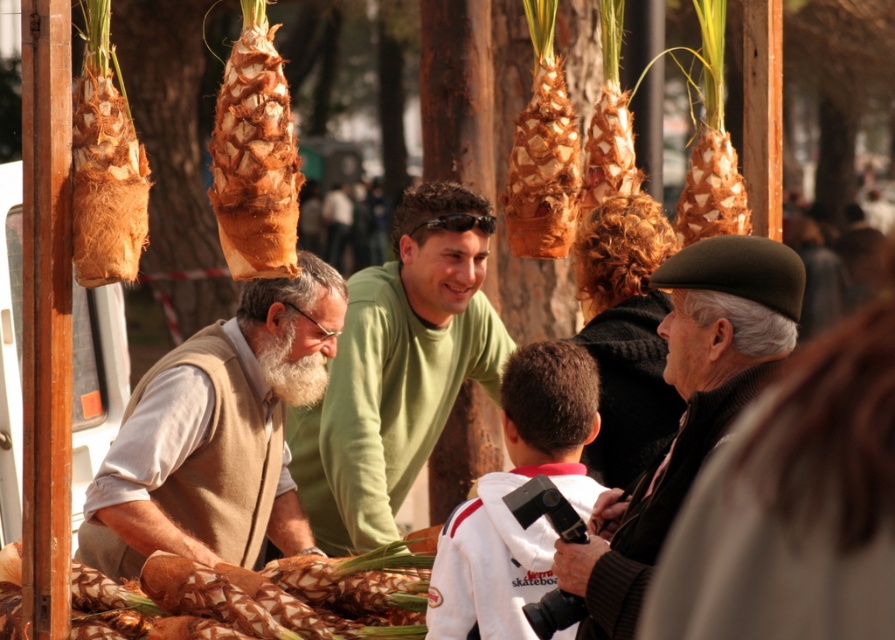
Can you confirm if dark brown wool beret at center right is positioned to the right of brown textured pineapple at center?

Indeed, dark brown wool beret at center right is positioned on the right side of brown textured pineapple at center.

Is dark brown wool beret at center right wider than brown textured pineapple at center?

No, dark brown wool beret at center right is not wider than brown textured pineapple at center.

The image size is (895, 640). Find the location of `dark brown wool beret at center right`. dark brown wool beret at center right is located at coordinates pyautogui.click(x=687, y=410).

Does beige wool vest at left have a larger size compared to dark brown wool beret at center right?

Indeed, beige wool vest at left has a larger size compared to dark brown wool beret at center right.

Can you confirm if beige wool vest at left is positioned to the left of dark brown wool beret at center right?

Correct, you'll find beige wool vest at left to the left of dark brown wool beret at center right.

Measure the distance between point (273,512) and camera.

They are 13.43 meters apart.

Find the location of a particular element. beige wool vest at left is located at coordinates (218, 433).

In the scene shown: Can you confirm if green matte sweater at center is positioned above white fleece jacket at center?

Indeed, green matte sweater at center is positioned over white fleece jacket at center.

From the picture: Is green matte sweater at center bigger than white fleece jacket at center?

Yes.

The height and width of the screenshot is (640, 895). I want to click on green matte sweater at center, so click(398, 369).

Locate an element on the screen. Image resolution: width=895 pixels, height=640 pixels. green matte sweater at center is located at coordinates (398, 369).